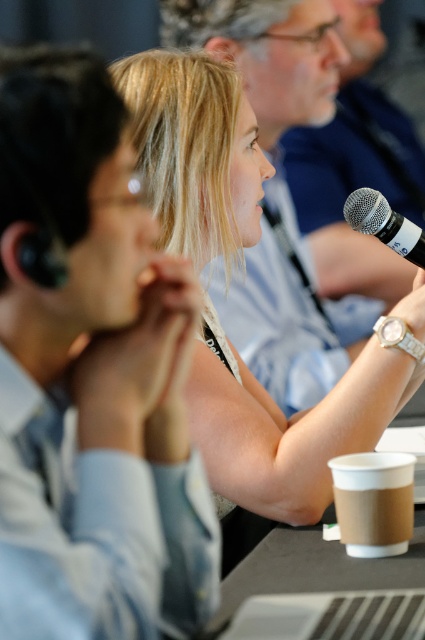
You are a server at a conference and need to place a brown paper cup at lower right and a silver metallic microphone at upper right on a table. Which object requires a larger surface area to place?

The silver metallic microphone at upper right requires a larger surface area because its width is greater than the brown paper cup at lower right.

You are a photographer standing at the back of the room. You want to take a photo of the smooth skin woman at center and the person with headset on the left. How far apart should you position them in the photo to ensure both are in focus?

The smooth skin woman at center and the person with headset on the left are 1.26 meters apart. To ensure both are in focus, position them so there is at least 1.26 meters between them in the photo.